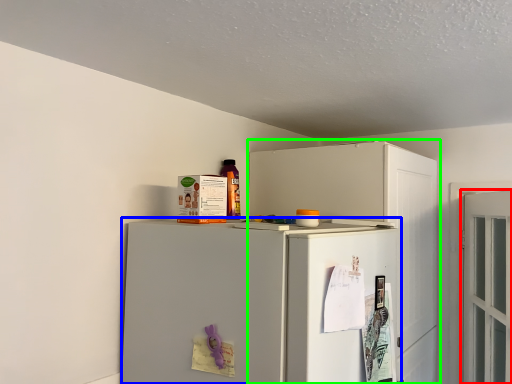
Question: Which object is the closest to the door (highlighted by a red box)? Choose among these: refrigerator (highlighted by a blue box) or cabinetry (highlighted by a green box).

Choices:
 (A) refrigerator
 (B) cabinetry

Answer: (B)